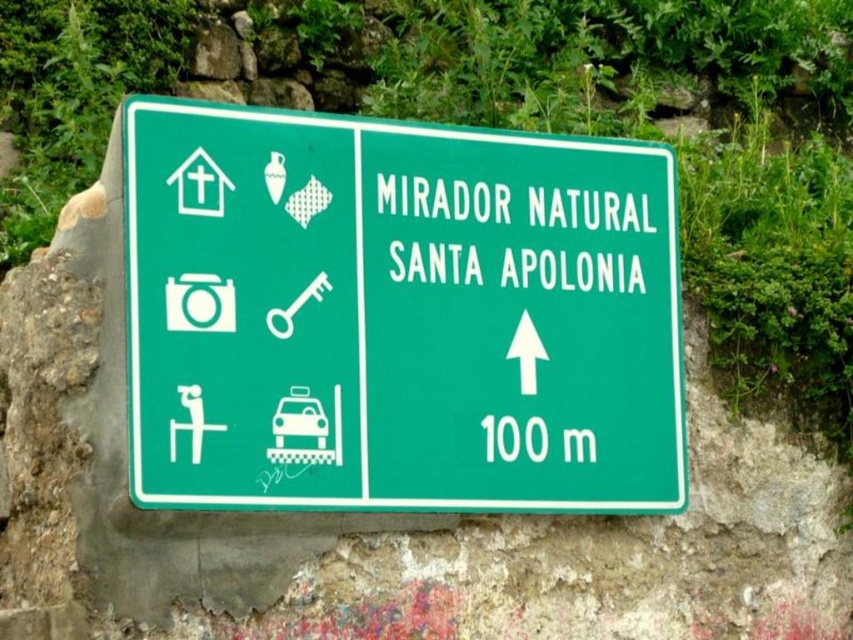
Question: Which point is farther to the camera?

Choices:
 (A) green matte sign at center
 (B) matte white taxi at center

Answer: (B)

Question: Considering the relative positions of green matte sign at center and matte white taxi at center in the image provided, where is green matte sign at center located with respect to matte white taxi at center?

Choices:
 (A) left
 (B) right

Answer: (B)

Question: Which point is closer to the camera?

Choices:
 (A) (277, 404)
 (B) (635, 496)

Answer: (A)

Question: Is green matte sign at center smaller than matte white taxi at center?

Choices:
 (A) yes
 (B) no

Answer: (B)

Question: Is green matte sign at center smaller than matte white taxi at center?

Choices:
 (A) no
 (B) yes

Answer: (A)